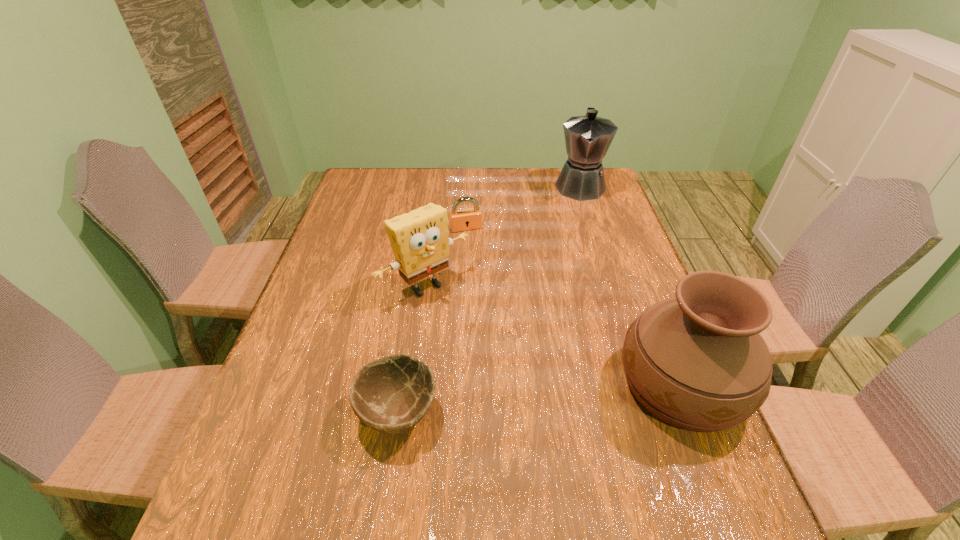
At what (x,y) coordinates should I click in order to perform the action: click on vacant space that's between the third nearest object and the farthest object. Please return your answer as a coordinate pair (x, y). Looking at the image, I should click on (502, 236).

Locate an element on the screen. This screenshot has height=540, width=960. free point between the third nearest object and the coffeepot is located at coordinates (502, 236).

The height and width of the screenshot is (540, 960). I want to click on free area in between the bowl and the coffeepot, so click(489, 299).

Locate an element on the screen. Image resolution: width=960 pixels, height=540 pixels. free space that is in between the third farthest object and the coffeepot is located at coordinates (502, 236).

Find the location of a particular element. The width and height of the screenshot is (960, 540). free space between the shortest object and the second shortest object is located at coordinates (432, 320).

This screenshot has width=960, height=540. Identify the location of empty space that is in between the farthest object and the urn. (631, 285).

Find the location of a particular element. The image size is (960, 540). empty space between the urn and the coffeepot is located at coordinates (631, 285).

Locate an element on the screen. This screenshot has width=960, height=540. free space between the bowl and the padlock is located at coordinates (432, 320).

The width and height of the screenshot is (960, 540). What are the coordinates of `free space between the coffeepot and the third nearest object` in the screenshot? It's located at (502, 236).

Locate which object is the third closest to the third farthest object. Please provide its 2D coordinates. Your answer should be formatted as a tuple, i.e. [(x, y)], where the tuple contains the x and y coordinates of a point satisfying the conditions above.

[(697, 362)]